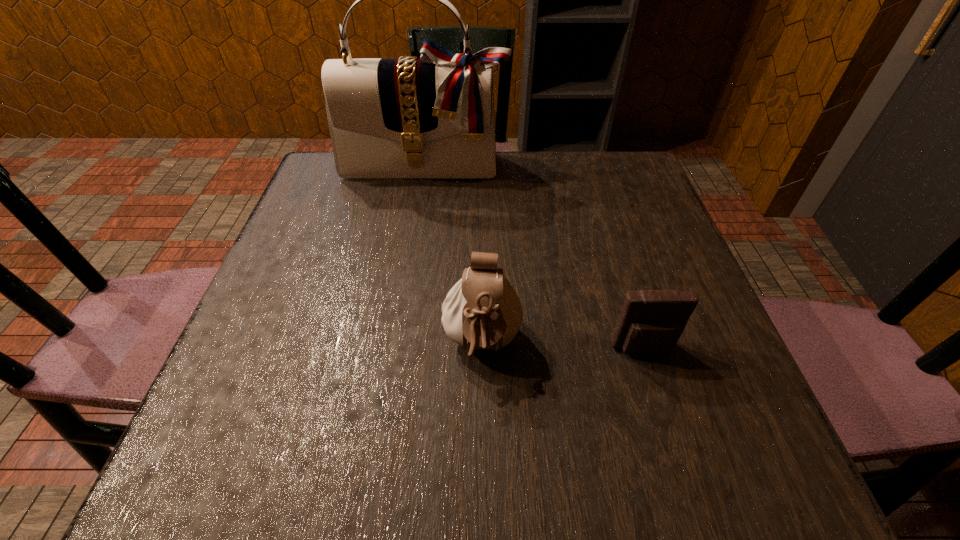
Identify which object is located as the second nearest to the shorter pouch. Please provide its 2D coordinates. Your answer should be formatted as a tuple, i.e. [(x, y)], where the tuple contains the x and y coordinates of a point satisfying the conditions above.

[(433, 117)]